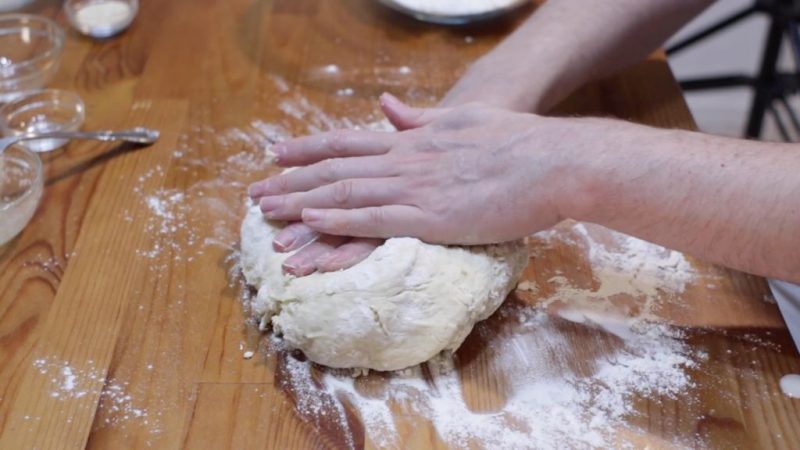
Find the location of a particular element. white wall is located at coordinates (404, 432), (730, 54).